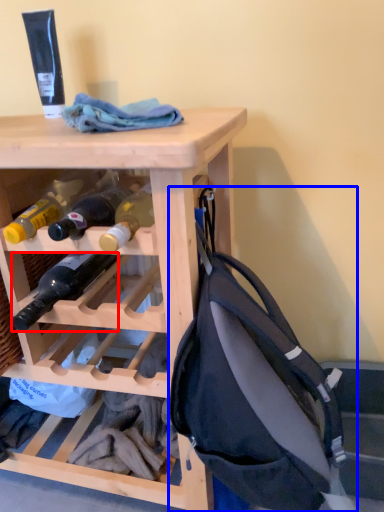
Question: Which of the following is the closest to the observer, bottle (highlighted by a red box) or backpack (highlighted by a blue box)?

Choices:
 (A) bottle
 (B) backpack

Answer: (B)